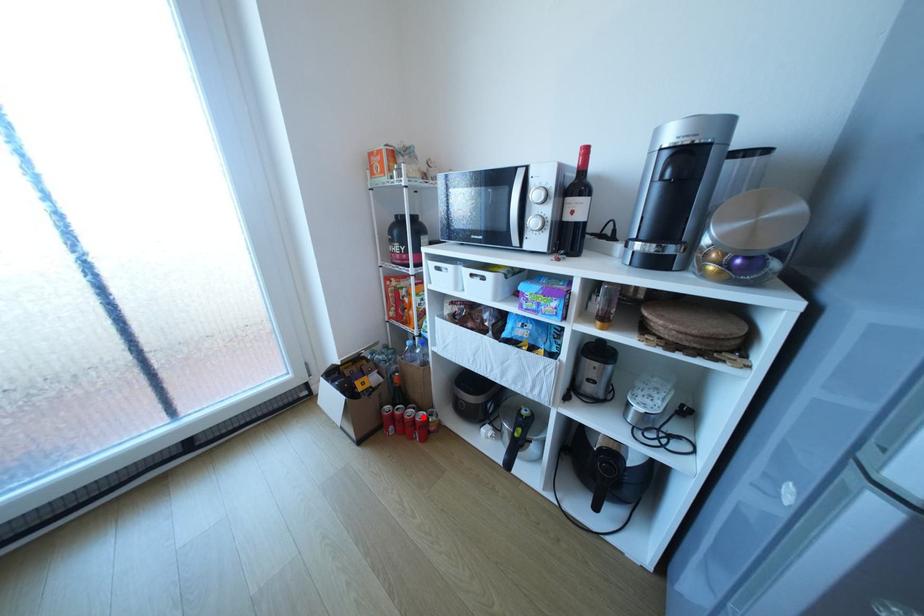
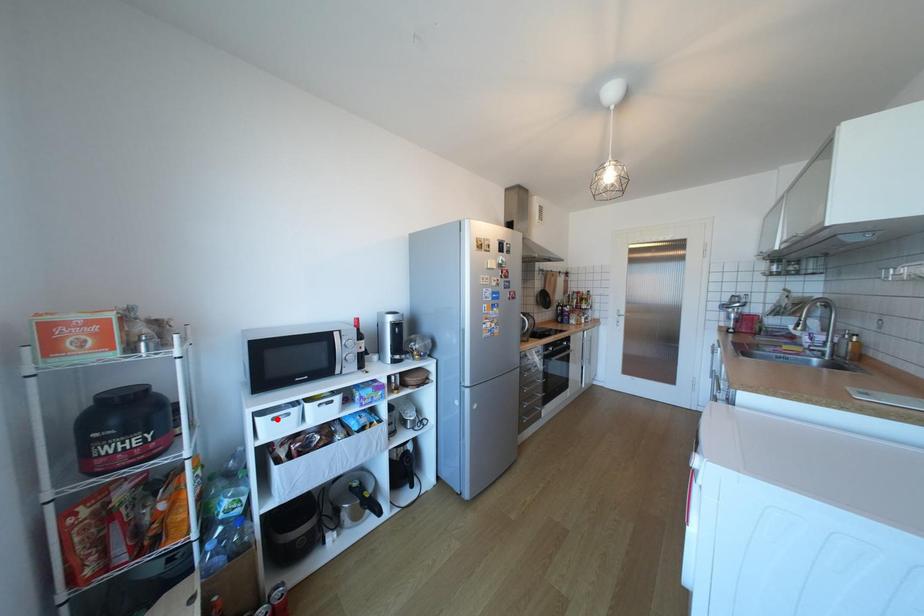
I am providing you with two images of the same scene from different viewpoints. A red point is marked on the first image and another point is marked on the second image. Does the point marked in image1 correspond to the same location as the one in image2?

No